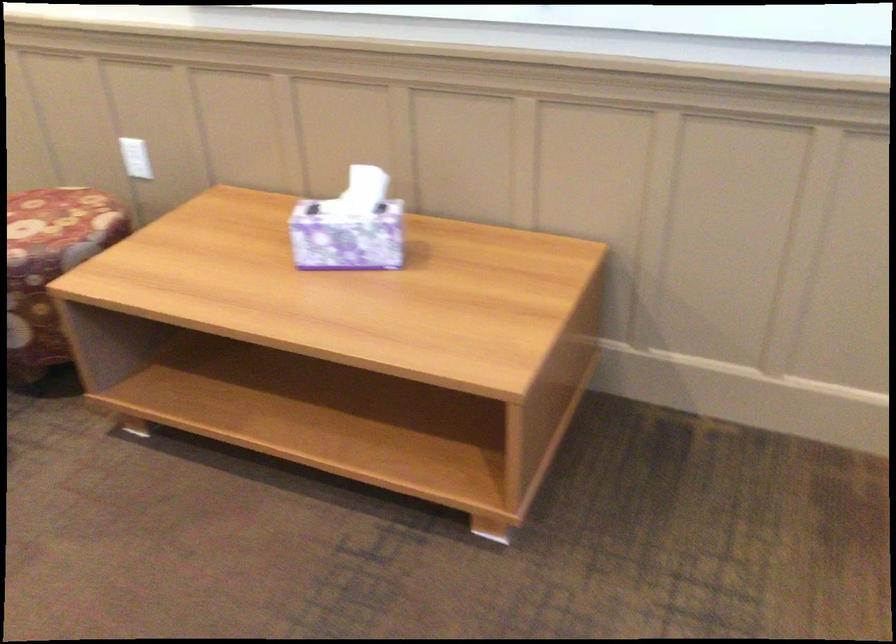
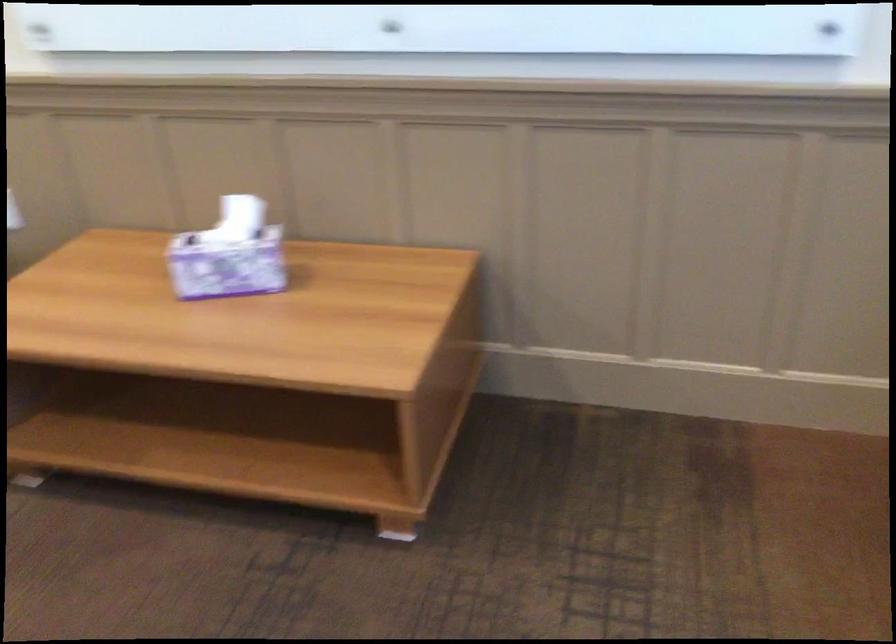
The point at (x=364, y=189) is marked in the first image. Where is the corresponding point in the second image?

(239, 218)